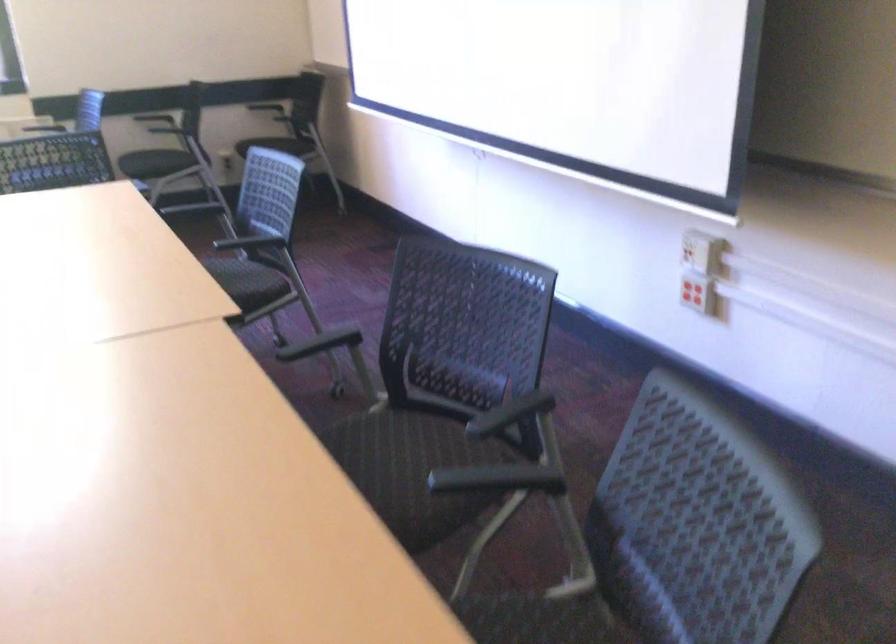
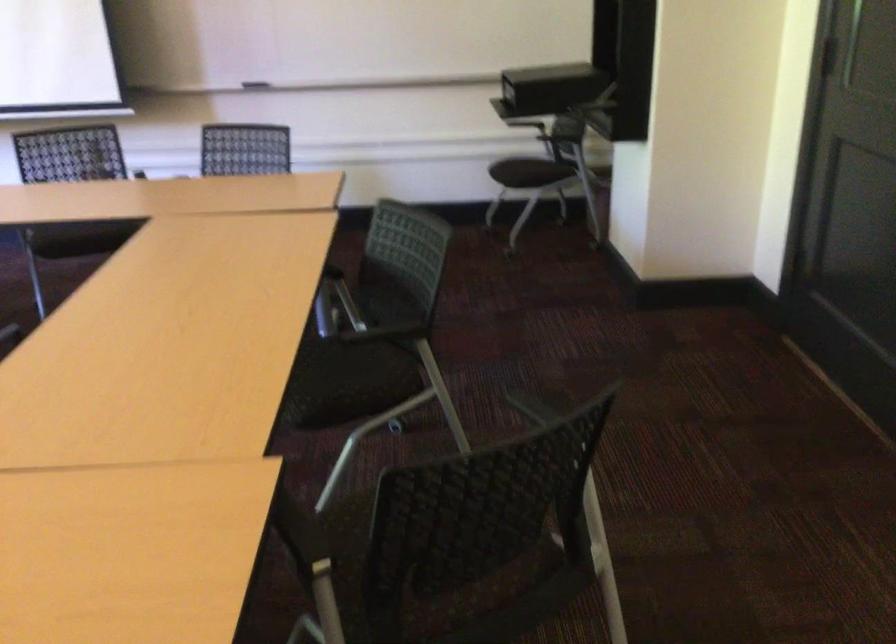
Question: I am providing you with two images of the same scene from different viewpoints. After the viewpoint changes to image2, which objects are now occluded?

Choices:
 (A) colorful shopping bag
 (B) chair sitting surface
 (C) black document camera
 (D) black chair armrest

Answer: (D)